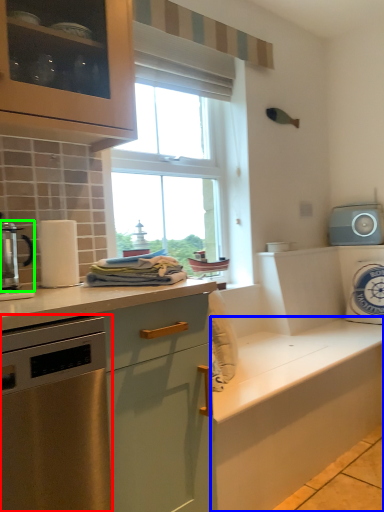
Question: Which is nearer to the home appliance (highlighted by a red box)? cabinetry (highlighted by a blue box) or kitchen appliance (highlighted by a green box).

Choices:
 (A) cabinetry
 (B) kitchen appliance

Answer: (B)